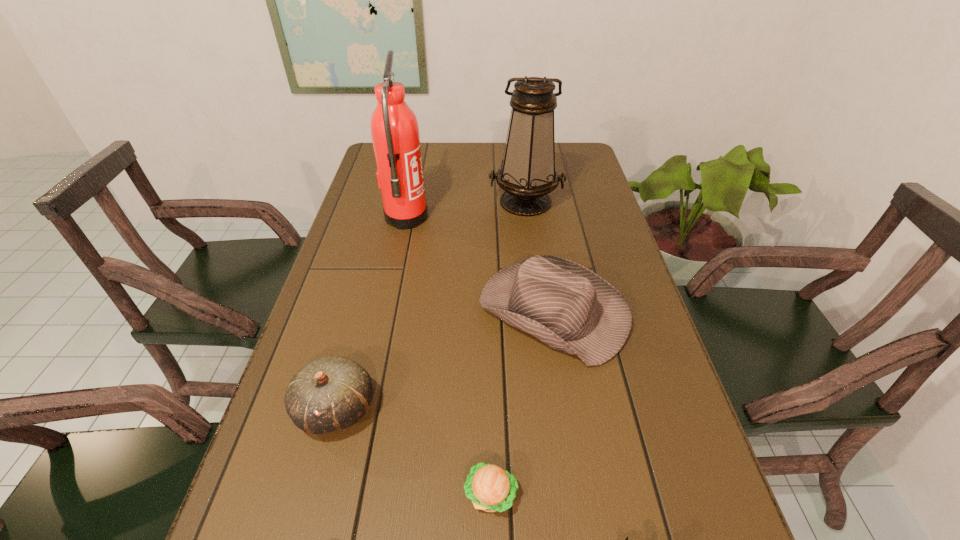
The image size is (960, 540). Identify the location of free region located on the left of the shortest object. (372, 494).

Locate an element on the screen. This screenshot has height=540, width=960. fire extinguisher situated at the left edge is located at coordinates (394, 128).

The image size is (960, 540). Find the location of `gourd situated at the left edge`. gourd situated at the left edge is located at coordinates (331, 393).

Where is `oil lamp at the right edge`? oil lamp at the right edge is located at coordinates (527, 174).

At what (x,y) coordinates should I click in order to perform the action: click on fedora that is at the right edge. Please return your answer as a coordinate pair (x, y). The image size is (960, 540). Looking at the image, I should click on (570, 308).

I want to click on free space at the far edge of the desktop, so click(449, 153).

Locate an element on the screen. vacant space at the left edge of the desktop is located at coordinates (348, 220).

Locate an element on the screen. Image resolution: width=960 pixels, height=540 pixels. vacant area at the right edge of the desktop is located at coordinates (577, 198).

In order to click on vacant space at the far left corner in this screenshot , I will do `click(372, 159)`.

In order to click on free region at the far right corner of the desktop in this screenshot , I will do pyautogui.click(x=593, y=168).